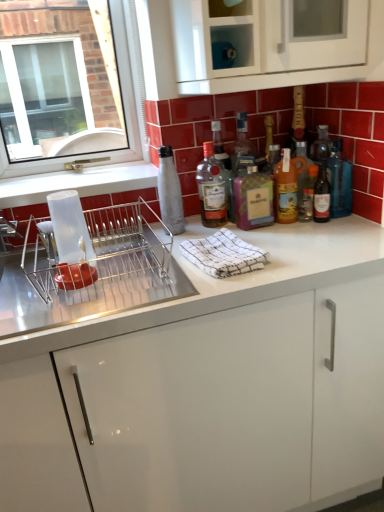
Where is `vacant space to the right of matte glass bottle at center, the 4th bottle when ordered from right to left`? The height and width of the screenshot is (512, 384). vacant space to the right of matte glass bottle at center, the 4th bottle when ordered from right to left is located at coordinates (319, 230).